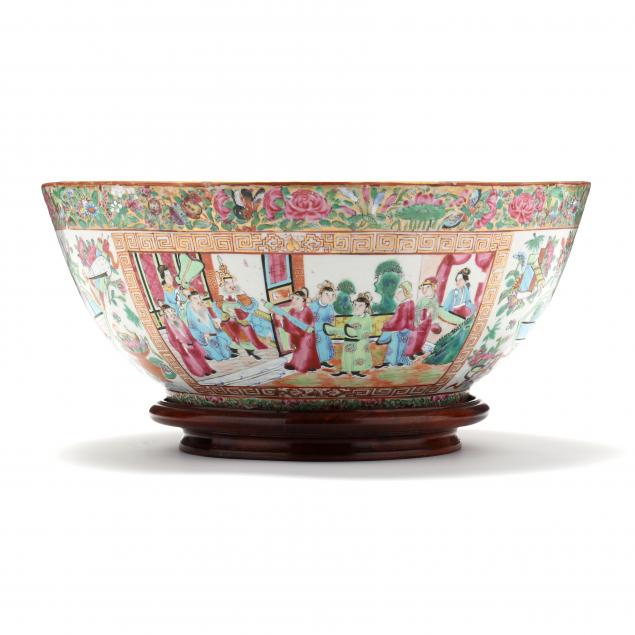
Locate an element on the screen. The height and width of the screenshot is (635, 635). bowl is located at coordinates (369, 251).